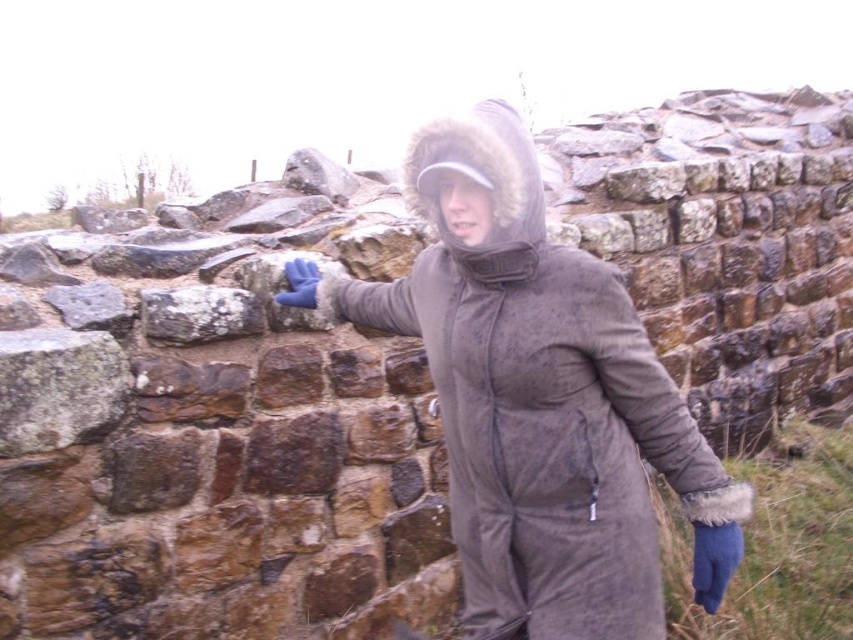
Question: Does brown fuzzy coat at center appear on the left side of blue synthetic glove at upper center?

Choices:
 (A) no
 (B) yes

Answer: (A)

Question: Can you confirm if brown fuzzy coat at center is thinner than speckled stone at upper left?

Choices:
 (A) yes
 (B) no

Answer: (B)

Question: Which point is farther to the camera?

Choices:
 (A) brown fuzzy coat at center
 (B) speckled stone at upper left

Answer: (B)

Question: Does speckled stone at upper left have a larger size compared to blue synthetic glove at upper center?

Choices:
 (A) yes
 (B) no

Answer: (A)

Question: Which object is farther from the camera taking this photo?

Choices:
 (A) brown fuzzy coat at center
 (B) speckled stone at upper left
 (C) blue synthetic glove at upper center

Answer: (C)

Question: Which of the following is the farthest from the observer?

Choices:
 (A) brown fuzzy coat at center
 (B) speckled stone at upper left

Answer: (B)